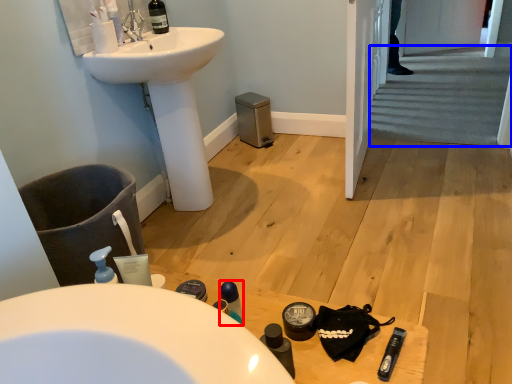
Question: Which object is further to the camera taking this photo, mouthwash (highlighted by a red box) or stairs (highlighted by a blue box)?

Choices:
 (A) mouthwash
 (B) stairs

Answer: (B)